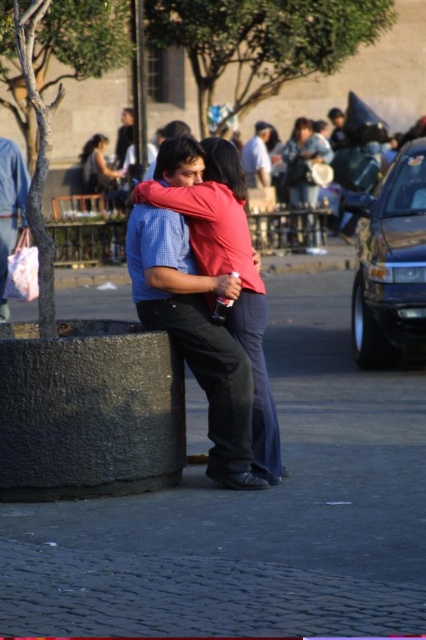
Question: Can you confirm if matte red shirt at center is positioned above matte pink sweater at upper center?

Choices:
 (A) yes
 (B) no

Answer: (B)

Question: Among these objects, which one is farthest from the camera?

Choices:
 (A) matte pink sweater at upper left
 (B) matte blue shirt at left
 (C) light blue shirt at center

Answer: (C)

Question: Which of these objects is positioned closest to the matte red shirt at center?

Choices:
 (A) matte blue shirt at left
 (B) matte pink sweater at upper left
 (C) light blue shirt at center

Answer: (A)

Question: Which point is closer to the camera?

Choices:
 (A) (255, 140)
 (B) (307, 120)
 (C) (17, 212)

Answer: (C)

Question: Is matte pink sweater at upper center positioned at the back of matte pink sweater at upper left?

Choices:
 (A) no
 (B) yes

Answer: (A)

Question: Is matte pink sweater at upper left wider than light blue shirt at center?

Choices:
 (A) yes
 (B) no

Answer: (A)